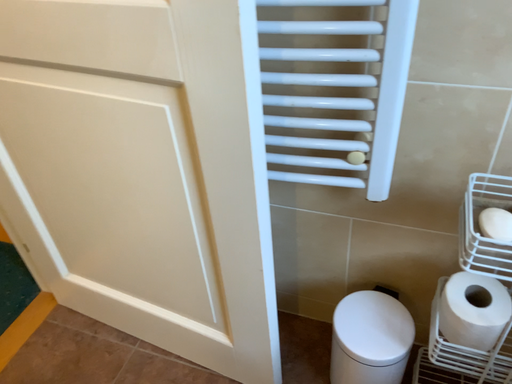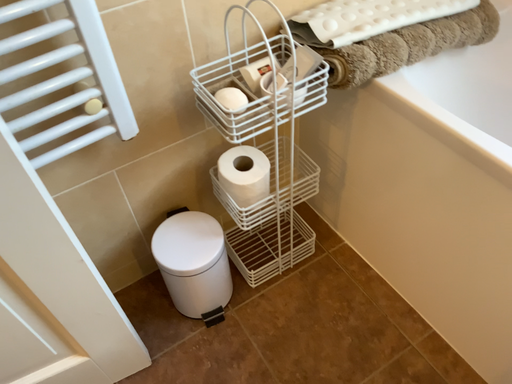
Question: Which way did the camera rotate in the video?

Choices:
 (A) rotated downward
 (B) rotated upward

Answer: (B)